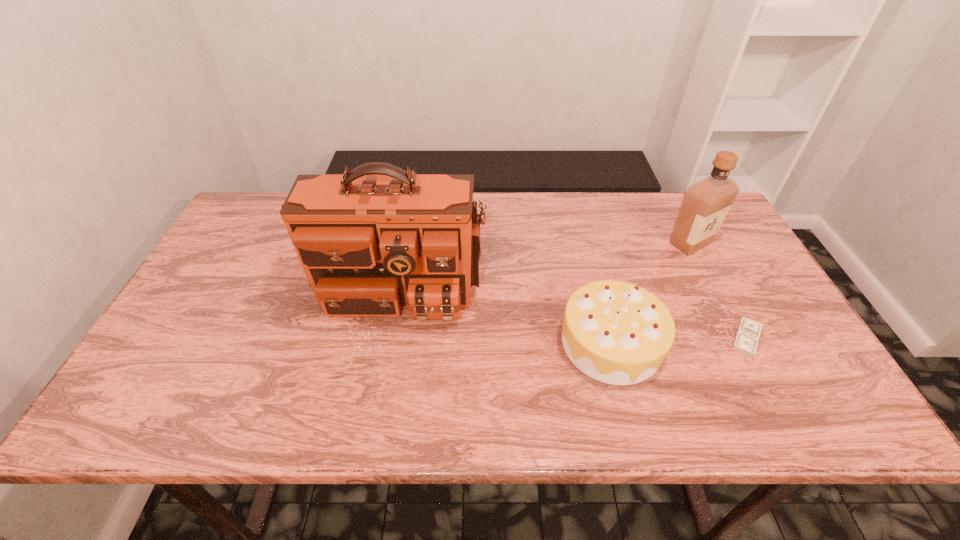
You are a GUI agent. You are given a task and a screenshot of the screen. Output one action in this format:
    pyautogui.click(x=<x>, y=<y>)
    Task: Click on the tallest object
    The image size is (960, 540).
    Given the screenshot: What is the action you would take?
    pyautogui.click(x=371, y=241)

Where is `the leftmost object`? the leftmost object is located at coordinates (371, 241).

This screenshot has width=960, height=540. Find the location of `the third shortest object`. the third shortest object is located at coordinates coord(705,204).

Locate an element on the screen. The width and height of the screenshot is (960, 540). the second object from left to right is located at coordinates (615, 332).

Identify the location of birthday cake. (615, 332).

The width and height of the screenshot is (960, 540). I want to click on money, so click(747, 336).

Where is `vacant space located on the face side of the satchel`? Image resolution: width=960 pixels, height=540 pixels. vacant space located on the face side of the satchel is located at coordinates (380, 392).

Find the location of a particular element. vacant space located on the front-facing side of the liquor is located at coordinates (706, 273).

You are a GUI agent. You are given a task and a screenshot of the screen. Output one action in this format:
    pyautogui.click(x=<x>, y=<y>)
    Task: Click on the vacant space situated on the left of the second shortest object
    This screenshot has height=540, width=960.
    Given the screenshot: What is the action you would take?
    pyautogui.click(x=515, y=343)

The height and width of the screenshot is (540, 960). What are the coordinates of `free space located on the back of the money` in the screenshot? It's located at (712, 275).